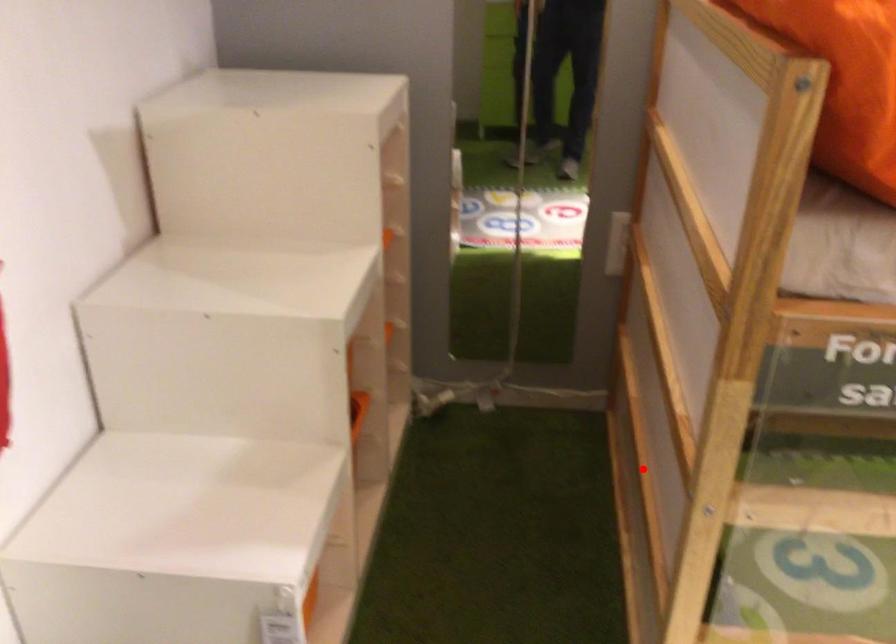
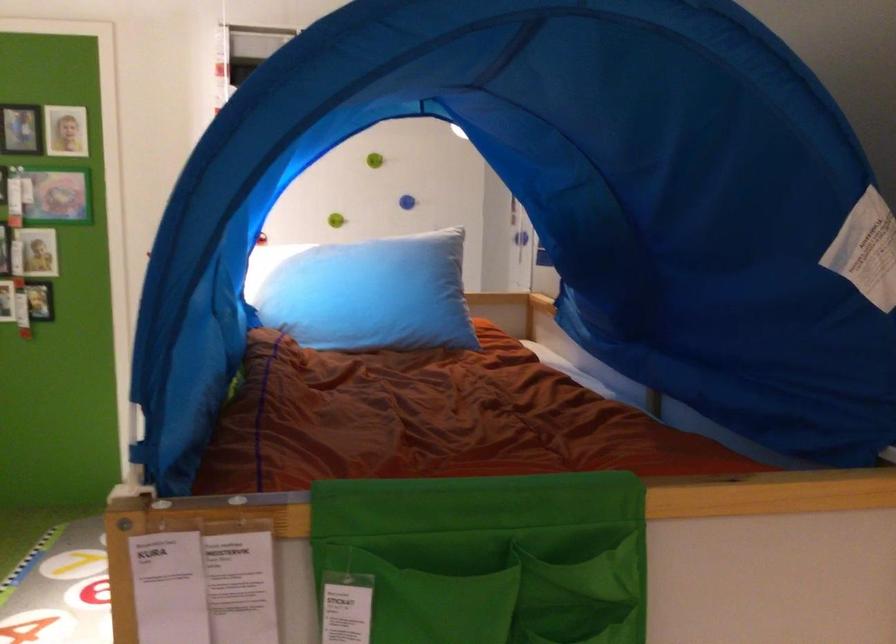
Question: I am providing you with two images of the same scene from different viewpoints. A red point is marked on the first image. Can you still see the location of the red point in image 2?

Choices:
 (A) Yes
 (B) No

Answer: (B)